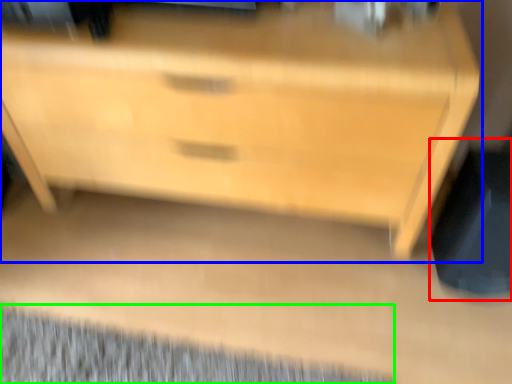
Question: Based on their relative distances, which object is nearer to swivel chair (highlighted by a red box)? Choose from chest of drawers (highlighted by a blue box) and mat (highlighted by a green box).

Choices:
 (A) chest of drawers
 (B) mat

Answer: (A)